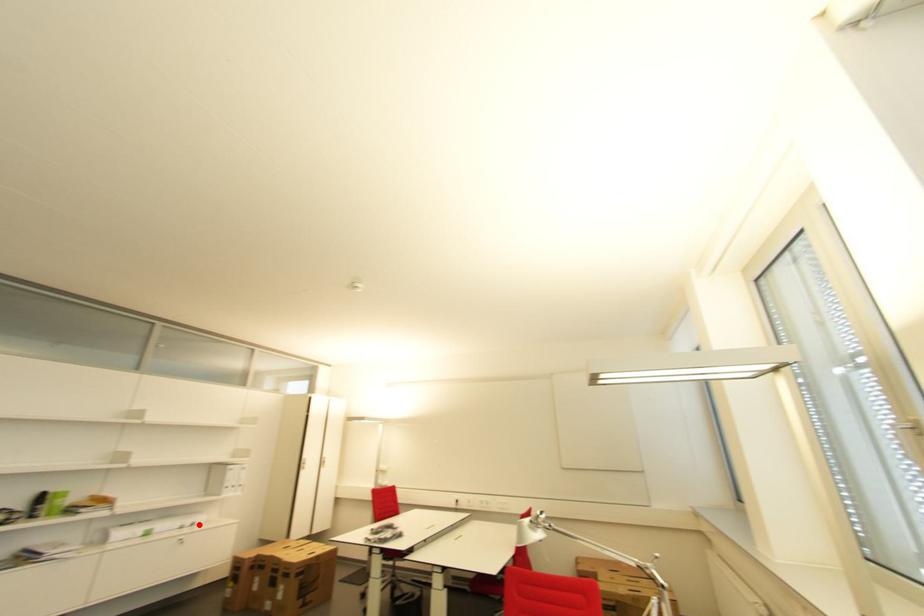
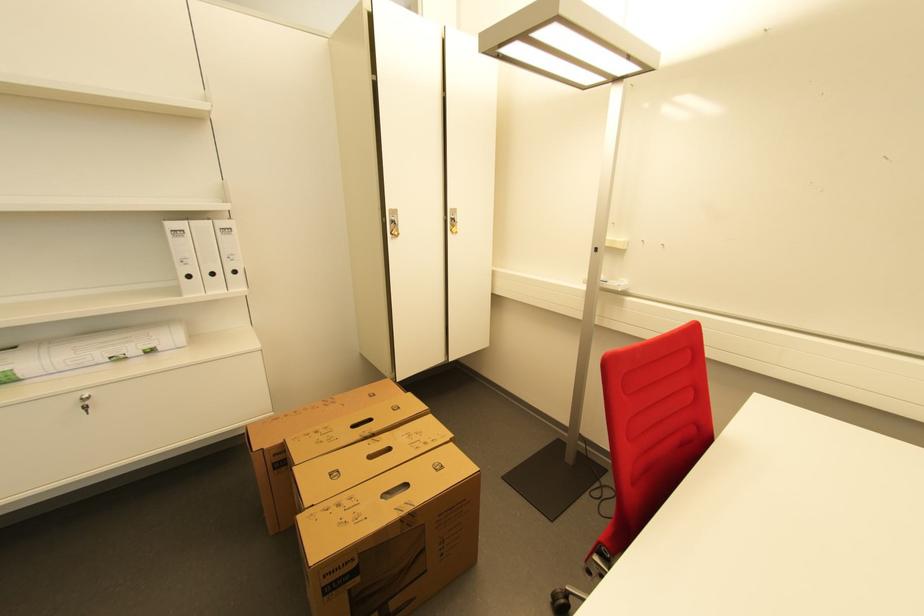
Locate, in the second image, the point that corresponds to the highlighted location in the first image.

(155, 352)